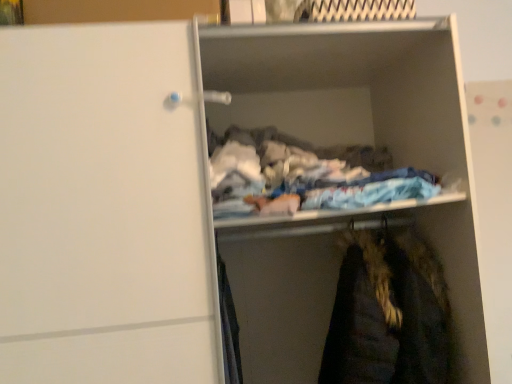
Question: Is white matte clothes at center wider or thinner than velvet-like dark brown coat at lower right?

Choices:
 (A) thin
 (B) wide

Answer: (A)

Question: Is white matte clothes at center taller or shorter than velvet-like dark brown coat at lower right?

Choices:
 (A) short
 (B) tall

Answer: (A)

Question: Is point (403, 105) positioned closer to the camera than point (328, 377)?

Choices:
 (A) closer
 (B) farther

Answer: (B)

Question: From their relative heights in the image, would you say velvet-like dark brown coat at lower right is taller or shorter than white matte clothes at center?

Choices:
 (A) short
 (B) tall

Answer: (B)

Question: Based on their positions, is velvet-like dark brown coat at lower right located to the left or right of white matte clothes at center?

Choices:
 (A) right
 (B) left

Answer: (A)

Question: Considering the positions of point (349, 342) and point (284, 220), is point (349, 342) closer or farther from the camera than point (284, 220)?

Choices:
 (A) farther
 (B) closer

Answer: (A)

Question: Looking at their shapes, would you say velvet-like dark brown coat at lower right is wider or thinner than white matte clothes at center?

Choices:
 (A) wide
 (B) thin

Answer: (A)